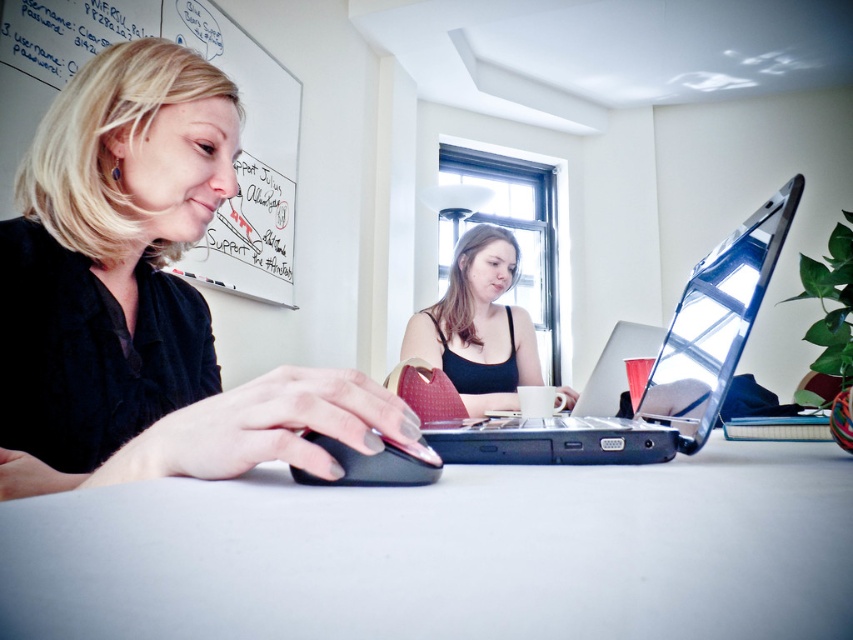
Question: Is black matte tank top at center positioned before black matte mouse at center?

Choices:
 (A) yes
 (B) no

Answer: (B)

Question: Can you confirm if gray matte table at center is positioned to the right of black matte tank top at center?

Choices:
 (A) no
 (B) yes

Answer: (B)

Question: Estimate the real-world distances between objects in this image. Which object is farther from the black matte mouse at center?

Choices:
 (A) black plastic laptop at center
 (B) matte black mouse at center

Answer: (B)

Question: Does gray matte table at center appear over black matte tank top at center?

Choices:
 (A) no
 (B) yes

Answer: (A)

Question: Which of the following is the closest to the observer?

Choices:
 (A) gray matte table at center
 (B) black plastic laptop at center
 (C) black matte tank top at center

Answer: (A)

Question: Which object is farther from the camera taking this photo?

Choices:
 (A) black matte mouse at center
 (B) matte black mouse at center
 (C) black plastic laptop at center
 (D) gray matte table at center

Answer: (C)